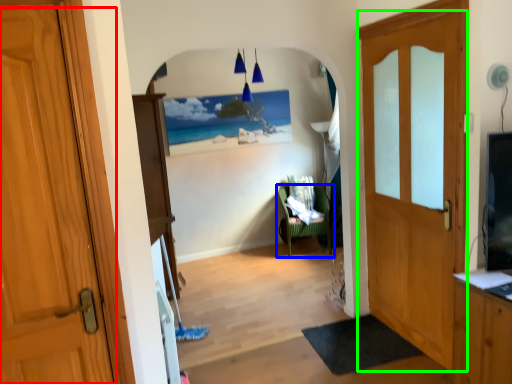
Question: Estimate the real-world distances between objects in this image. Which object is closer to door (highlighted by a red box), chair (highlighted by a blue box) or door (highlighted by a green box)?

Choices:
 (A) chair
 (B) door

Answer: (B)